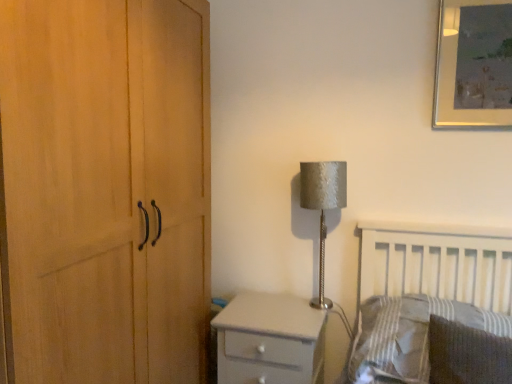
Question: Is white glossy chest of drawers at lower center to the left or to the right of metallic silver picture frame at upper right in the image?

Choices:
 (A) left
 (B) right

Answer: (A)

Question: Is white glossy chest of drawers at lower center wider or thinner than metallic silver picture frame at upper right?

Choices:
 (A) wide
 (B) thin

Answer: (A)

Question: Estimate the real-world distances between objects in this image. Which object is farther from the metallic silver picture frame at upper right?

Choices:
 (A) striped fabric pillow at lower right, the first pillow viewed from the back
 (B) silver textured lampshade at upper right
 (C) white glossy chest of drawers at lower center
 (D) dark gray textured pillow at lower right, the 1th pillow in the front-to-back sequence

Answer: (C)

Question: Considering the real-world distances, which object is farthest from the dark gray textured pillow at lower right, the 2th pillow from the back?

Choices:
 (A) white glossy chest of drawers at lower center
 (B) silver textured lampshade at upper right
 (C) metallic silver picture frame at upper right
 (D) striped fabric pillow at lower right, the second pillow in the front-to-back sequence

Answer: (C)